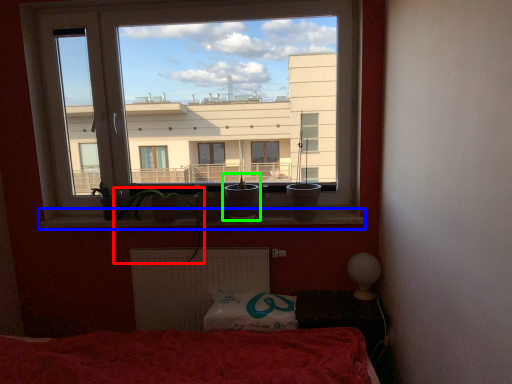
Question: Which object is the farthest from plant (highlighted by a red box)? Choose among these: window sill (highlighted by a blue box) or houseplant (highlighted by a green box).

Choices:
 (A) window sill
 (B) houseplant

Answer: (B)